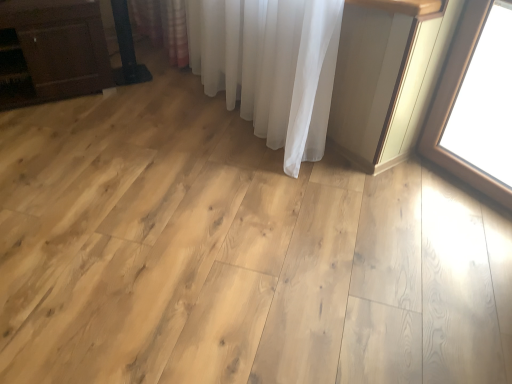
Question: Considering the relative sizes of matte brown cabinet at left and white sheer curtain at center in the image provided, is matte brown cabinet at left smaller than white sheer curtain at center?

Choices:
 (A) yes
 (B) no

Answer: (A)

Question: From a real-world perspective, does matte brown cabinet at left stand above white sheer curtain at center?

Choices:
 (A) yes
 (B) no

Answer: (B)

Question: Considering the relative sizes of matte brown cabinet at left and white sheer curtain at center in the image provided, is matte brown cabinet at left thinner than white sheer curtain at center?

Choices:
 (A) no
 (B) yes

Answer: (A)

Question: Is matte brown cabinet at left with white sheer curtain at center?

Choices:
 (A) no
 (B) yes

Answer: (A)

Question: Can you confirm if matte brown cabinet at left is positioned to the right of white sheer curtain at center?

Choices:
 (A) yes
 (B) no

Answer: (B)

Question: From the image's perspective, is matte brown cabinet at left located beneath white sheer curtain at center?

Choices:
 (A) yes
 (B) no

Answer: (A)

Question: From a real-world perspective, is white sheer curtain at center positioned under matte brown cabinet at left based on gravity?

Choices:
 (A) yes
 (B) no

Answer: (B)

Question: From a real-world perspective, is white sheer curtain at center located higher than matte brown cabinet at left?

Choices:
 (A) yes
 (B) no

Answer: (A)

Question: Does white sheer curtain at center lie in front of matte brown cabinet at left?

Choices:
 (A) yes
 (B) no

Answer: (A)

Question: Does white sheer curtain at center contain matte brown cabinet at left?

Choices:
 (A) no
 (B) yes

Answer: (A)

Question: Can you confirm if white sheer curtain at center is taller than matte brown cabinet at left?

Choices:
 (A) yes
 (B) no

Answer: (A)

Question: Are white sheer curtain at center and matte brown cabinet at left far apart?

Choices:
 (A) yes
 (B) no

Answer: (A)

Question: Is point (8, 16) closer or farther from the camera than point (267, 18)?

Choices:
 (A) closer
 (B) farther

Answer: (B)